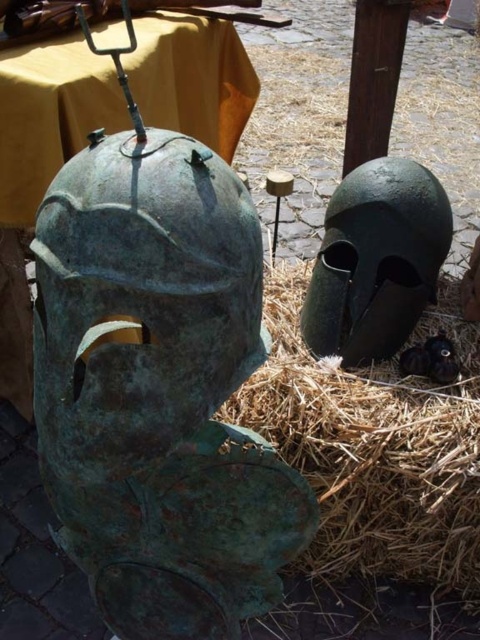
You are standing in front of the helmets and want to touch the closest point to the camera between the two points marked as point (86, 426) and point (428, 232). Which point should you reach for?

Point (86, 426) is closer to the camera than point (428, 232), so you should reach for point (86, 426).

You are standing in front of the two ancient helmets displayed outdoors. You notice two specific points marked on them. Which of the two points, point (410, 436) or point (369, 304), is closer to your eyes?

Point (410, 436) is closer to the camera than point (369, 304).

You are an archaeologist examining two ancient helmets displayed outdoors. You see the green patinated bronze helmet at left and the green patinated metal helmet at upper right. Which helmet is positioned to the left of the other?

The green patinated bronze helmet at left is positioned to the left of the green patinated metal helmet at upper right.